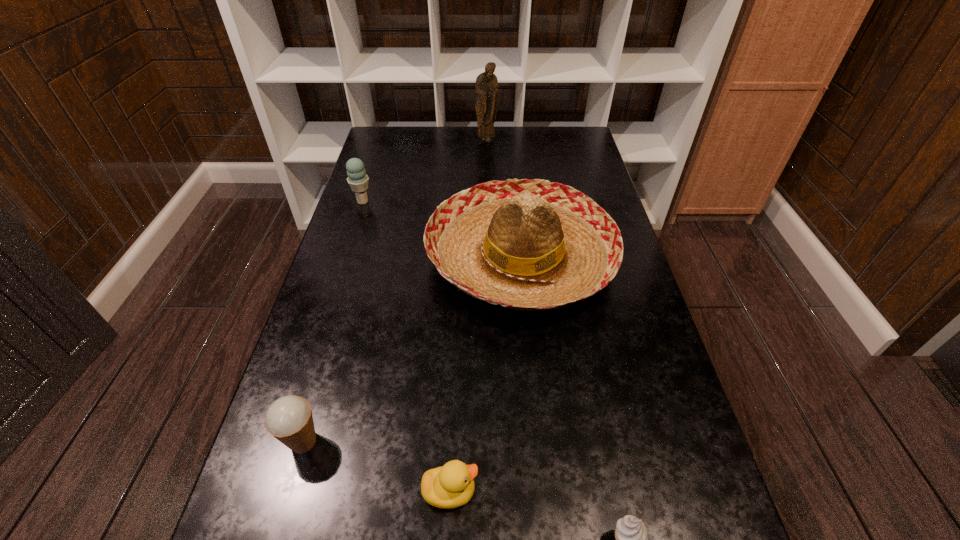
The height and width of the screenshot is (540, 960). What are the coordinates of `vacant space located on the back of the second nearest icecream` in the screenshot? It's located at (332, 343).

At what (x,y) coordinates should I click in order to perform the action: click on vacant space located 0.180m on the face of the duckling. Please return your answer as a coordinate pair (x, y). This screenshot has height=540, width=960. Looking at the image, I should click on (582, 491).

This screenshot has height=540, width=960. I want to click on object that is at the far edge, so click(486, 87).

This screenshot has height=540, width=960. I want to click on object at the right edge, so click(x=533, y=245).

This screenshot has width=960, height=540. I want to click on free spot at the far edge of the desktop, so click(x=452, y=158).

In the image, there is a desktop. At what (x,y) coordinates should I click in order to perform the action: click on free region at the left edge. Please return your answer as a coordinate pair (x, y). Image resolution: width=960 pixels, height=540 pixels. Looking at the image, I should click on (367, 173).

Image resolution: width=960 pixels, height=540 pixels. Find the location of `vacant space at the right edge`. vacant space at the right edge is located at coordinates (576, 180).

Image resolution: width=960 pixels, height=540 pixels. I want to click on vacant area at the far right corner, so click(x=579, y=130).

The width and height of the screenshot is (960, 540). Find the location of `free area in between the second nearest object and the third nearest object`. free area in between the second nearest object and the third nearest object is located at coordinates (376, 467).

Identify the location of vacant space that is in between the second nearest object and the second farthest icecream. pyautogui.click(x=376, y=467).